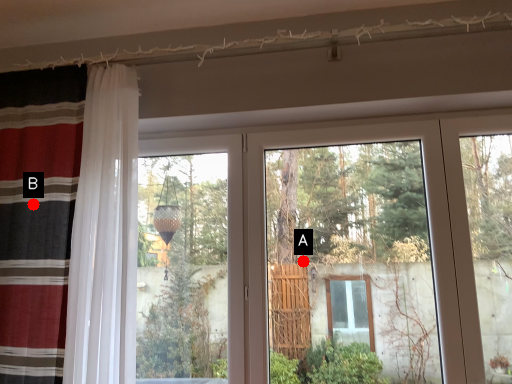
Question: Two points are circled on the image, labeled by A and B beside each circle. Which point appears closest to the camera in this image?

Choices:
 (A) A is closer
 (B) B is closer

Answer: (B)